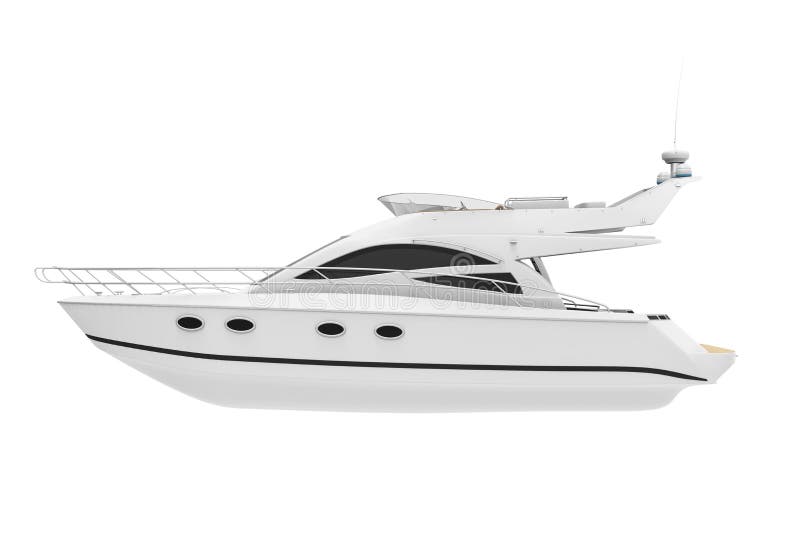
Find the location of a particular element. The height and width of the screenshot is (560, 800). window is located at coordinates (406, 207).